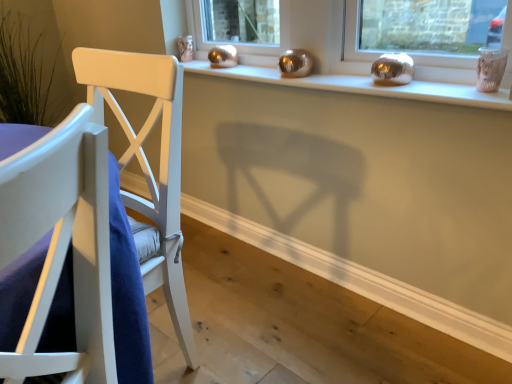
Locate an element on the screen. white wood chair at left is located at coordinates (62, 245).

What do you see at coordinates (62, 245) in the screenshot? I see `white wood chair at left` at bounding box center [62, 245].

Locate an element on the screen. satin gold ornaments at upper center is located at coordinates (365, 86).

Describe the element at coordinates (365, 86) in the screenshot. The width and height of the screenshot is (512, 384). I see `satin gold ornaments at upper center` at that location.

Identify the location of white wood chair at left. Image resolution: width=512 pixels, height=384 pixels. (62, 245).

Which object is positioned more to the right, satin gold ornaments at upper center or white wood chair at left?

satin gold ornaments at upper center.

Is satin gold ornaments at upper center in front of or behind white wood chair at left in the image?

satin gold ornaments at upper center is behind white wood chair at left.

Which is further, [194,70] or [96,192]?

The point [194,70] is more distant.

From the image's perspective, between satin gold ornaments at upper center and white wood chair at left, which one is located above?

From the image's view, satin gold ornaments at upper center is above.

From a real-world perspective, between satin gold ornaments at upper center and white wood chair at left, who is vertically higher?

In real-world perspective, satin gold ornaments at upper center is above.

Which object is wider, satin gold ornaments at upper center or white wood chair at left?

white wood chair at left is wider.

Is satin gold ornaments at upper center taller than white wood chair at left?

No, satin gold ornaments at upper center is not taller than white wood chair at left.

Looking at this image, between satin gold ornaments at upper center and white wood chair at left, which one has smaller size?

satin gold ornaments at upper center.

Is white wood chair at left completely or partially inside satin gold ornaments at upper center?

No.

Is satin gold ornaments at upper center next to white wood chair at left?

They are not placed beside each other.

In the scene shown: Is satin gold ornaments at upper center oriented away from white wood chair at left?

No, satin gold ornaments at upper center is not facing away from white wood chair at left.

Image resolution: width=512 pixels, height=384 pixels. Identify the location of window sill behind the white wood chair at left. (365, 86).

Considering the relative positions of white wood chair at left and satin gold ornaments at upper center in the image provided, is white wood chair at left to the left or to the right of satin gold ornaments at upper center?

From the image, it's evident that white wood chair at left is to the left of satin gold ornaments at upper center.

Which is in front, white wood chair at left or satin gold ornaments at upper center?

white wood chair at left is more forward.

Between point (91, 113) and point (202, 64), which one is positioned in front?

Point (91, 113)

From the image's perspective, relative to satin gold ornaments at upper center, is white wood chair at left above or below?

white wood chair at left is situated lower than satin gold ornaments at upper center in the image.

From a real-world perspective, between white wood chair at left and satin gold ornaments at upper center, who is vertically lower?

white wood chair at left.

Considering the sizes of white wood chair at left and satin gold ornaments at upper center in the image, is white wood chair at left wider or thinner than satin gold ornaments at upper center?

In the image, white wood chair at left appears to be wider than satin gold ornaments at upper center.

Between white wood chair at left and satin gold ornaments at upper center, which one has less height?

satin gold ornaments at upper center is shorter.

Looking at the image, does white wood chair at left seem bigger or smaller compared to satin gold ornaments at upper center?

In the image, white wood chair at left appears to be larger than satin gold ornaments at upper center.

Is satin gold ornaments at upper center completely or partially inside white wood chair at left?

That's incorrect, satin gold ornaments at upper center is not inside white wood chair at left.

Is white wood chair at left placed right next to satin gold ornaments at upper center?

No, white wood chair at left is not in contact with satin gold ornaments at upper center.

Is white wood chair at left oriented towards satin gold ornaments at upper center?

No, white wood chair at left is not turned towards satin gold ornaments at upper center.

What's the angular difference between white wood chair at left and satin gold ornaments at upper center's facing directions?

68.7 degrees.

Identify the location of window sill above the white wood chair at left (from a real-world perspective). tap(365, 86).

The width and height of the screenshot is (512, 384). I want to click on window sill lying above the white wood chair at left (from the image's perspective), so click(365, 86).

Where is `chair beneath the satin gold ornaments at upper center (from a real-world perspective)`? chair beneath the satin gold ornaments at upper center (from a real-world perspective) is located at coordinates click(x=62, y=245).